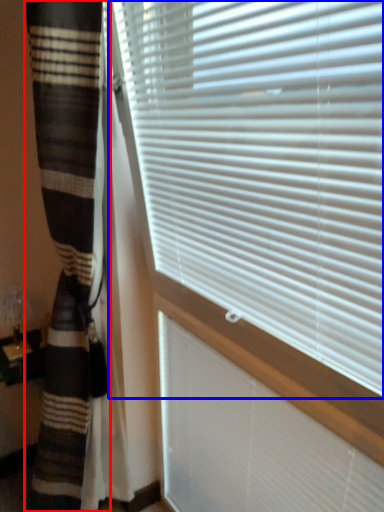
Question: Which object is closer to the camera taking this photo, curtain (highlighted by a red box) or window blind (highlighted by a blue box)?

Choices:
 (A) curtain
 (B) window blind

Answer: (B)